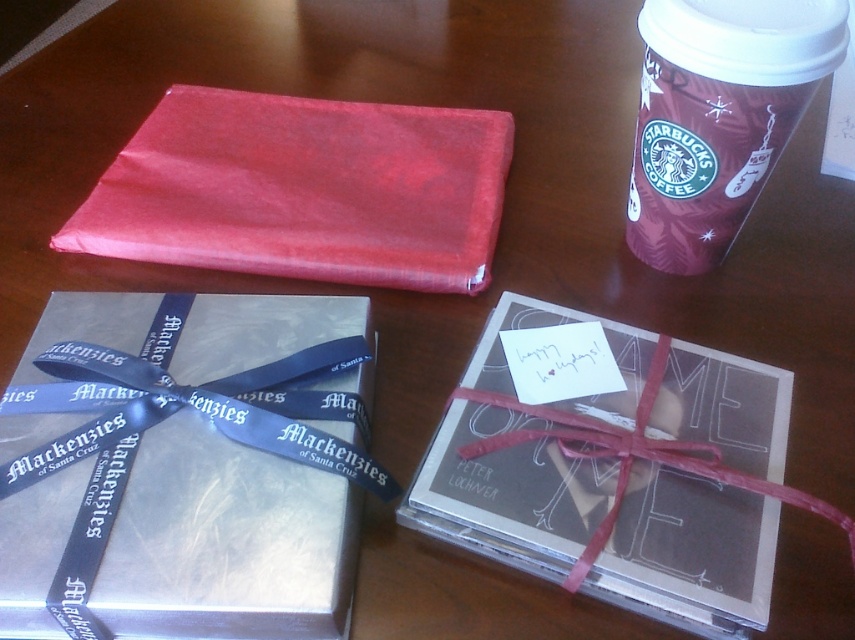
You are organizing items on a table and need to place a new item between the silver metallic gift at center and the maroon paper cup at upper right. Considering their sizes, which item should you place closer to the edge of the table to ensure stability?

Since the silver metallic gift at center is larger in size than the maroon paper cup at upper right, you should place the larger silver metallic gift at center closer to the edge of the table for better stability.

You are looking at the wooden table with items arranged on it. There are two points marked on the table surface at coordinates point (50, 337) and point (339, 262). If you were to place a small sticker on the table, which point would require you to reach closer to the edge of the table?

Point (50, 337) is closer to the camera than point (339, 262), so placing a sticker there would require reaching closer to the edge of the table.

You are organizing a gift basket and need to stack items vertically. The silver metallic gift at center and the maroon paper cup at upper right are both candidates. Which item should you choose for the base of the stack to ensure stability?

The silver metallic gift at center is much taller than the maroon paper cup at upper right, so it would provide a more stable base for stacking due to its greater height and likely larger surface area.